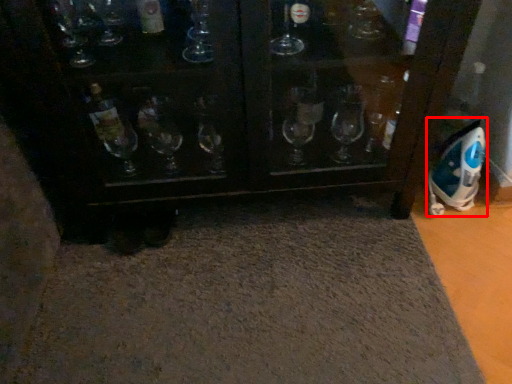
Question: From the image, what is the correct spatial relationship of appliance (annotated by the red box) in relation to bath mat?

Choices:
 (A) left
 (B) right

Answer: (B)